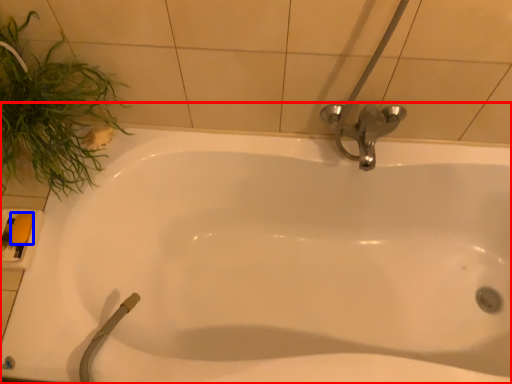
Question: Among these objects, which one is farthest to the camera, bathtub (highlighted by a red box) or soap (highlighted by a blue box)?

Choices:
 (A) bathtub
 (B) soap

Answer: (B)